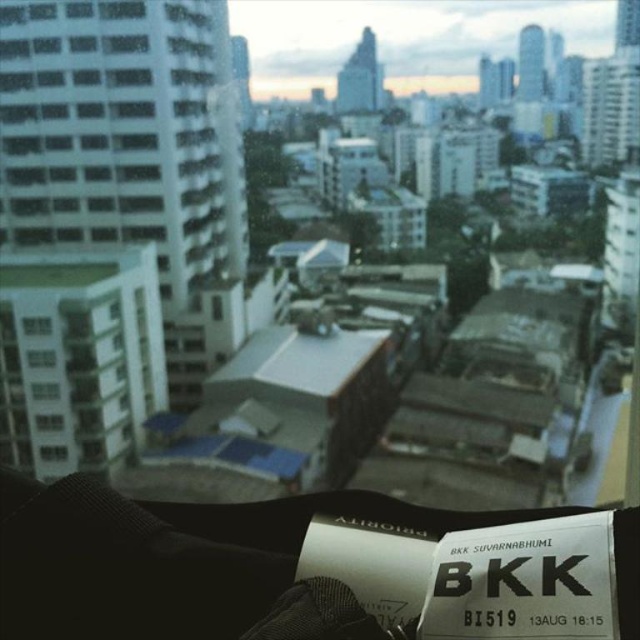
In the scene shown: Can you confirm if transparent plastic window at upper left is wider than transparent plastic window at lower left?

Yes.

Which of these two, transparent plastic window at upper left or transparent plastic window at lower left, stands taller?

transparent plastic window at upper left

What do you see at coordinates (36, 324) in the screenshot? I see `transparent plastic window at upper left` at bounding box center [36, 324].

Locate an element on the screen. transparent plastic window at upper left is located at coordinates (36, 324).